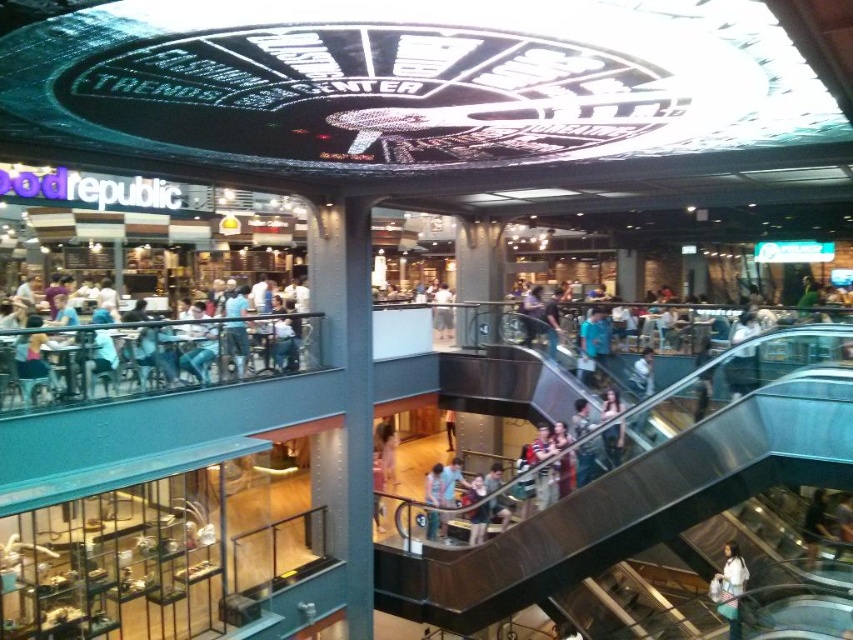
In the scene shown: You are standing at the entrance of the mall and see the point marked at coordinates (631, 506). What object is located at that point?

The point at coordinates (631, 506) corresponds to the metallic escalator at center.

You are a delivery person carrying a package that requires a clear path to the Food Republic restaurant area. You are currently standing next to the metallic escalator at center and need to reach the light brown leather jacket at center, which marks the entrance to the restaurant. Can your delivery cart, which is 2.5 meters long, fit through the space between them?

The distance between the metallic escalator at center and the light brown leather jacket at center is 3.04 meters. Since the delivery cart is 2.5 meters long, it can fit through the space as the distance is greater than the cart length.